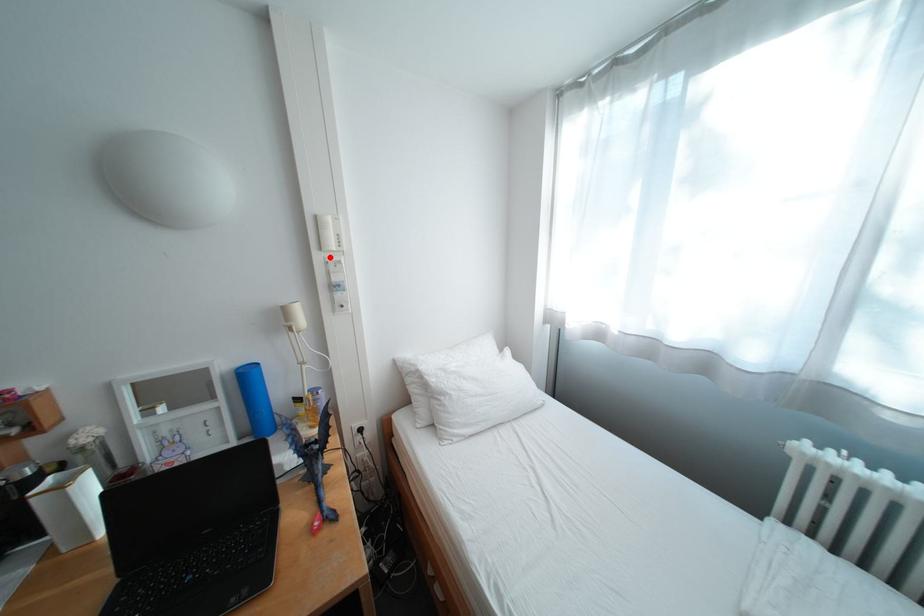
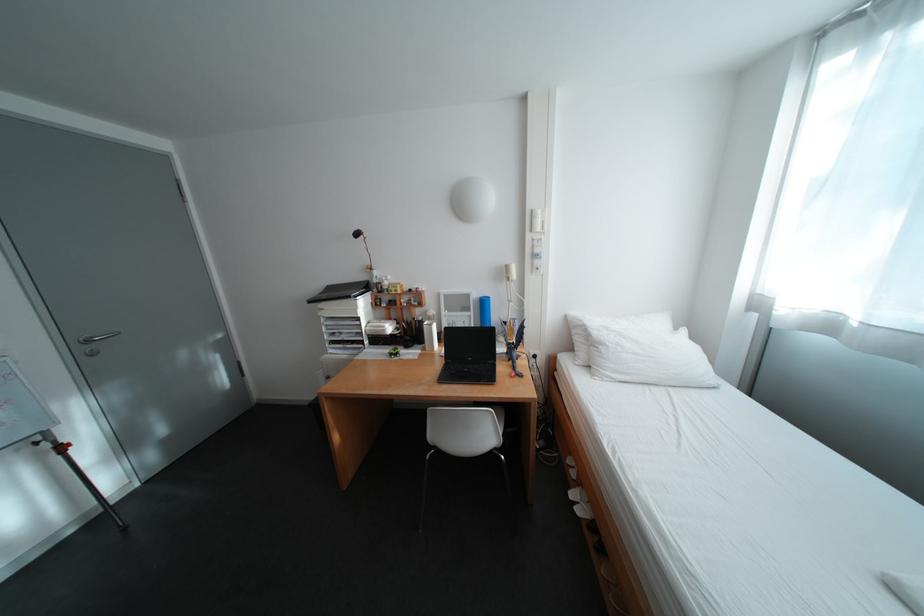
Locate, in the second image, the point that corresponds to the highlighted location in the first image.

(541, 237)